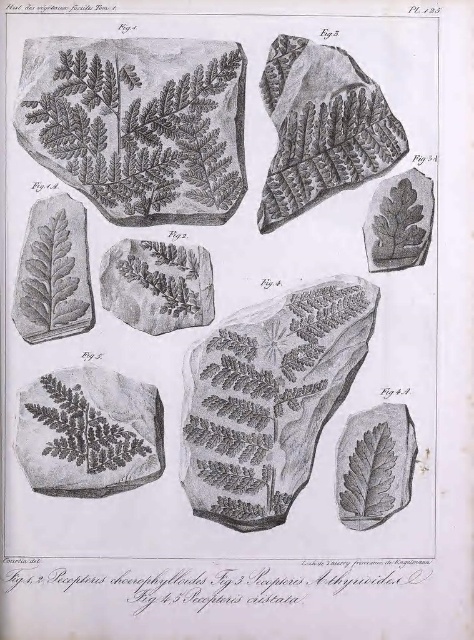
Between etched stone leaf at center and smooth gray leaf at lower right, which one appears on the left side from the viewer's perspective?

etched stone leaf at center

Describe the element at coordinates (270, 400) in the screenshot. I see `etched stone leaf at center` at that location.

Where is `etched stone leaf at center`? etched stone leaf at center is located at coordinates (270, 400).

Can you confirm if etched stone leaf at center is bigger than etched stone leaf at bottom left?

Yes, etched stone leaf at center is bigger than etched stone leaf at bottom left.

Which is in front, point (248, 456) or point (72, 380)?

Point (248, 456) is more forward.

The height and width of the screenshot is (640, 474). What do you see at coordinates (270, 400) in the screenshot?
I see `etched stone leaf at center` at bounding box center [270, 400].

At what (x,y) coordinates should I click in order to perform the action: click on etched stone leaf at center. Please return your answer as a coordinate pair (x, y). Looking at the image, I should click on (270, 400).

Which of these two, etched stone leaf at bottom left or gray textured leaf at center, stands shorter?

gray textured leaf at center is shorter.

How distant is etched stone leaf at bottom left from gray textured leaf at center?

The distance of etched stone leaf at bottom left from gray textured leaf at center is 6.93 inches.

This screenshot has height=640, width=474. What are the coordinates of `etched stone leaf at bottom left` in the screenshot? It's located at (89, 433).

Where is `etched stone leaf at bottom left`? etched stone leaf at bottom left is located at coordinates (89, 433).